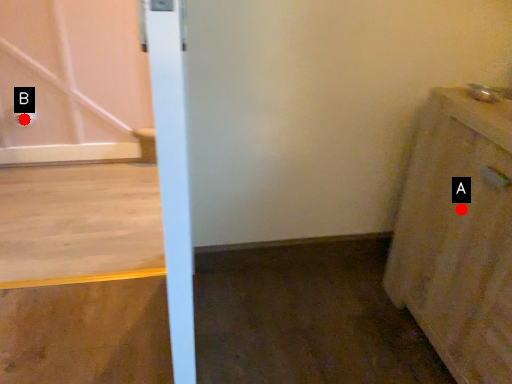
Question: Two points are circled on the image, labeled by A and B beside each circle. Which point is closer to the camera?

Choices:
 (A) A is closer
 (B) B is closer

Answer: (A)